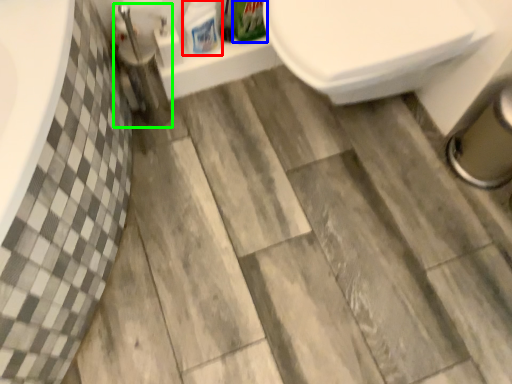
Question: Which object is the farthest from cleaning product (highlighted by a red box)? Choose among these: cleaning product (highlighted by a blue box) or plumbing fixture (highlighted by a green box).

Choices:
 (A) cleaning product
 (B) plumbing fixture

Answer: (B)